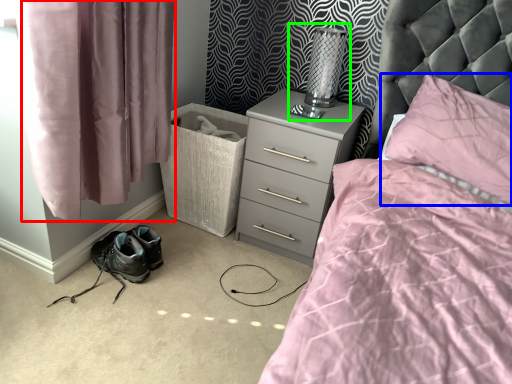
Question: Which is nearer to the curtain (highlighted by a red box)? pillow (highlighted by a blue box) or table lamp (highlighted by a green box).

Choices:
 (A) pillow
 (B) table lamp

Answer: (B)